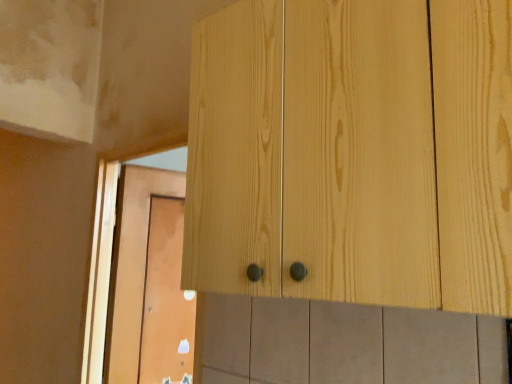
This screenshot has height=384, width=512. Describe the element at coordinates (150, 283) in the screenshot. I see `natural wood door at upper center` at that location.

Locate an element on the screen. Image resolution: width=512 pixels, height=384 pixels. natural wood door at upper center is located at coordinates (150, 283).

Locate an element on the screen. The height and width of the screenshot is (384, 512). natural wood door at upper center is located at coordinates (150, 283).